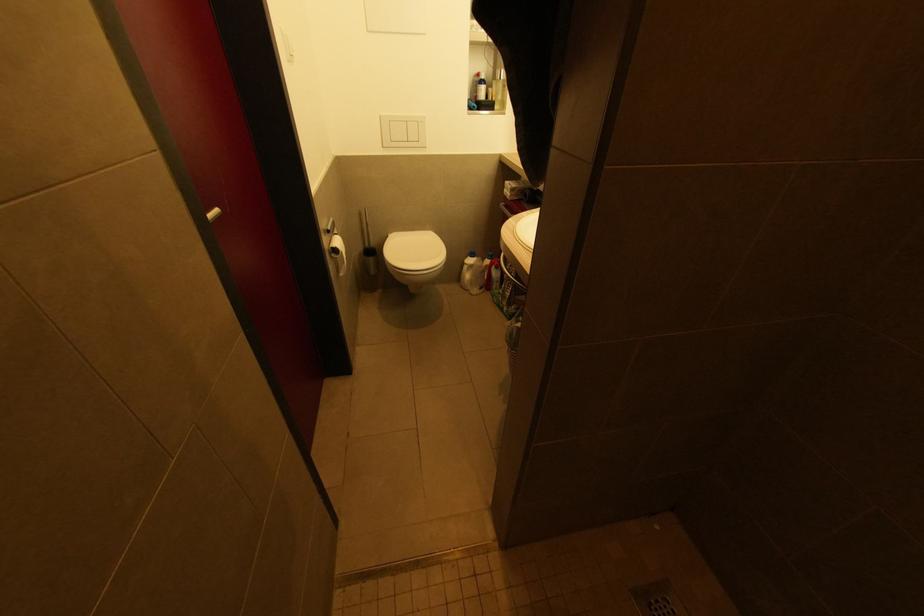
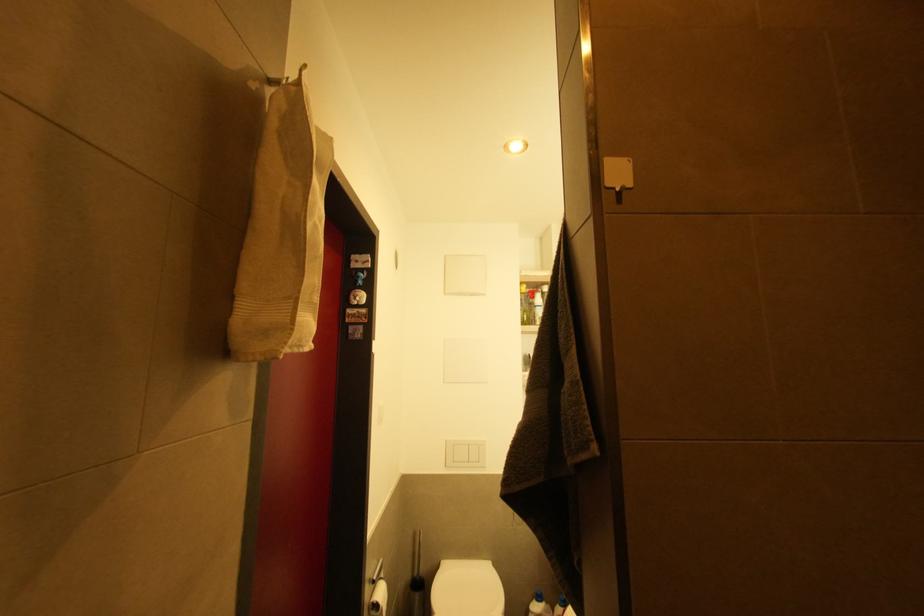
Question: The first image is from the beginning of the video and the second image is from the end. How did the camera likely rotate when shooting the video?

Choices:
 (A) Left
 (B) Right
 (C) Up
 (D) Down

Answer: (C)